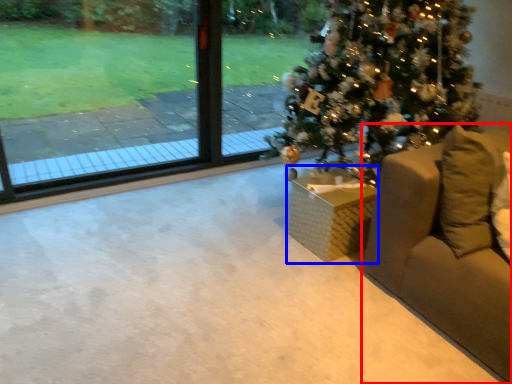
Question: Which point is closer to the camera, furniture (highlighted by a red box) or furniture (highlighted by a blue box)?

Choices:
 (A) furniture
 (B) furniture

Answer: (A)